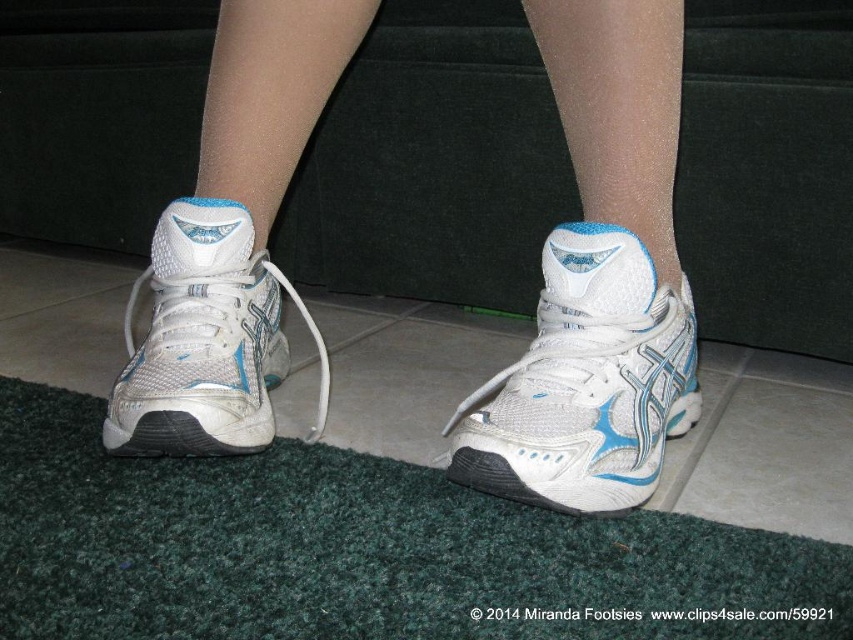
How distant is white mesh sneakers at center from white mesh shoe at lower left?

The distance of white mesh sneakers at center from white mesh shoe at lower left is 3.40 inches.

Who is shorter, white mesh sneakers at center or white mesh shoe at lower left?

Standing shorter between the two is white mesh shoe at lower left.

Between point (672, 410) and point (244, 406), which one is positioned in front?

Positioned in front is point (244, 406).

You are a GUI agent. You are given a task and a screenshot of the screen. Output one action in this format:
    pyautogui.click(x=<x>, y=<y>)
    Task: Click on the white mesh sneakers at center
    
    Given the screenshot: What is the action you would take?
    pyautogui.click(x=599, y=280)

Image resolution: width=853 pixels, height=640 pixels. What do you see at coordinates (585, 381) in the screenshot?
I see `white mesh shoe at center` at bounding box center [585, 381].

Can you confirm if white mesh shoe at center is positioned below white mesh shoe at lower left?

Correct, white mesh shoe at center is located below white mesh shoe at lower left.

The width and height of the screenshot is (853, 640). Find the location of `white mesh shoe at center`. white mesh shoe at center is located at coordinates (585, 381).

Does white mesh sneakers at center have a greater width compared to white mesh shoe at center?

Indeed, white mesh sneakers at center has a greater width compared to white mesh shoe at center.

Does white mesh sneakers at center lie behind white mesh shoe at center?

Yes, it is behind white mesh shoe at center.

Find the location of a particular element. The width and height of the screenshot is (853, 640). white mesh sneakers at center is located at coordinates (599, 280).